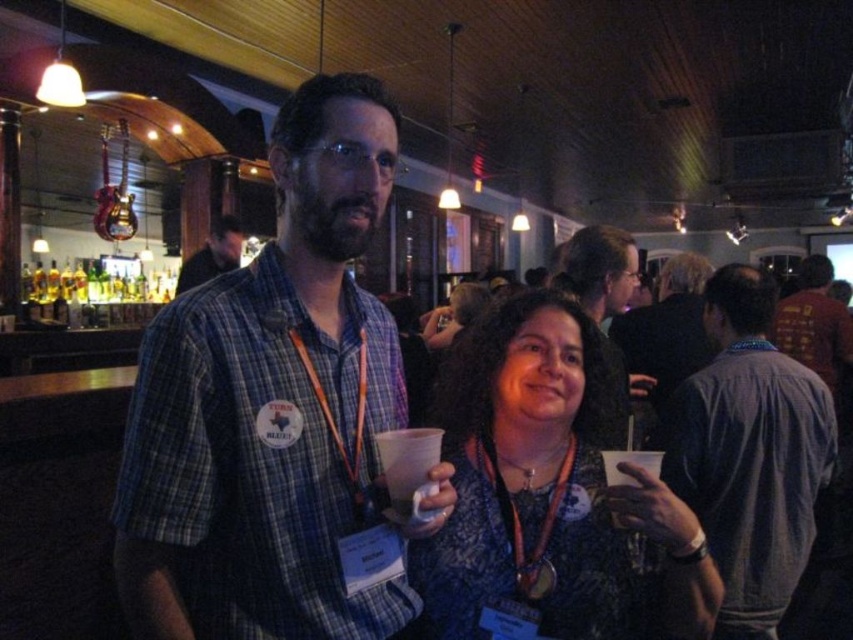
Can you confirm if matte black shirt at center is smaller than matte plaid shirt at center?

No.

Does point (608, 285) lie behind point (192, 275)?

No.

Is point (598, 248) closer to camera compared to point (180, 276)?

Yes, it is.

Locate an element on the screen. The height and width of the screenshot is (640, 853). matte black shirt at center is located at coordinates (596, 269).

Is blue lace dress at center to the right of matte plaid shirt at center from the viewer's perspective?

Yes, blue lace dress at center is to the right of matte plaid shirt at center.

Is point (547, 502) less distant than point (233, 246)?

Yes, point (547, 502) is in front of point (233, 246).

Locate an element on the screen. This screenshot has width=853, height=640. blue lace dress at center is located at coordinates (547, 493).

Is point (763, 509) positioned in front of point (239, 236)?

That is True.

Locate an element on the screen. gray fabric shirt at right is located at coordinates (750, 452).